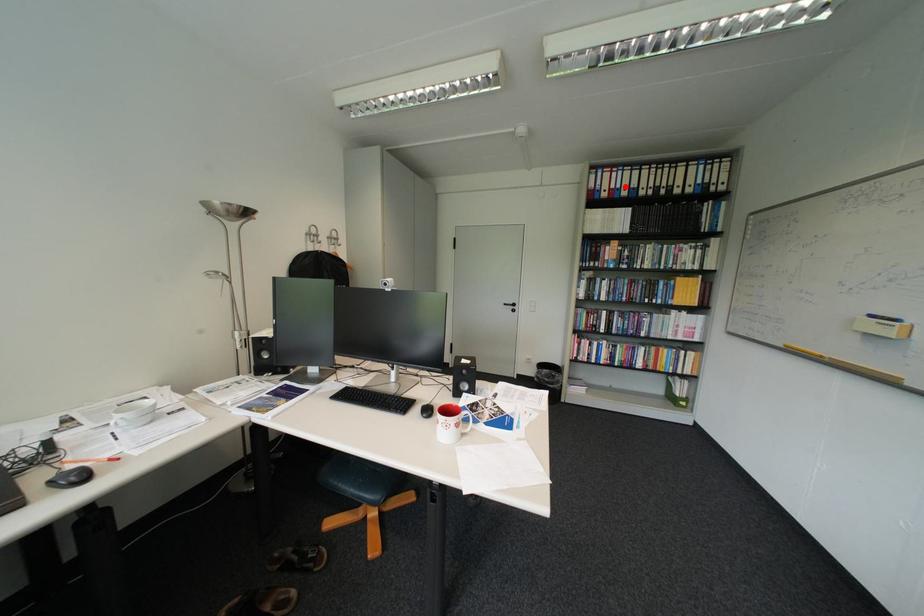
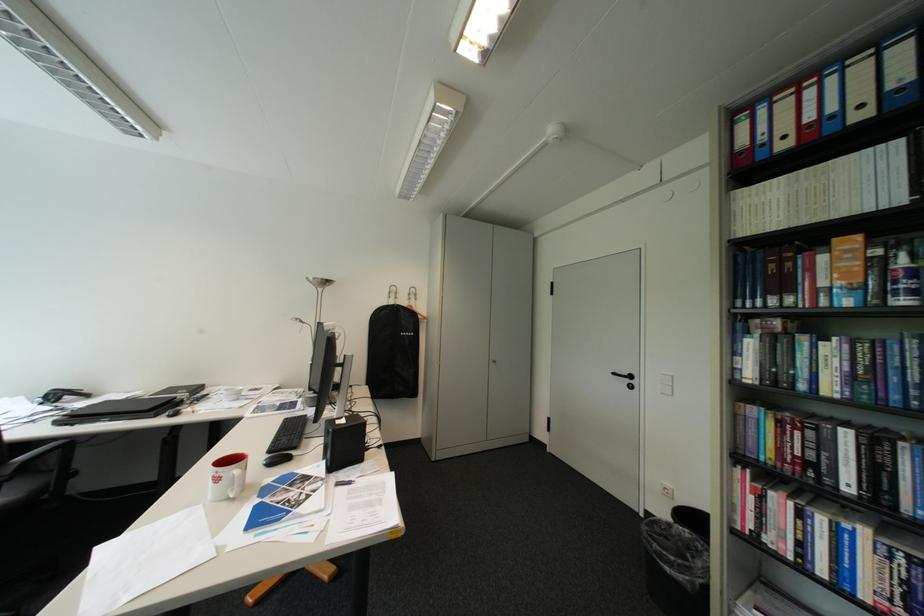
Find the pixel in the second image that matches the highlighted location in the first image.

(821, 119)